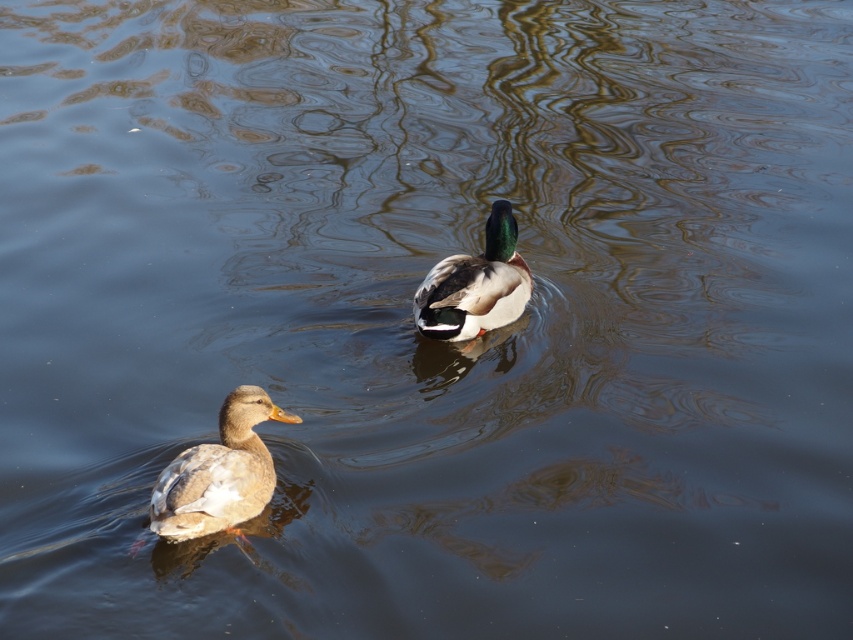
Is brown feathered duck at lower left above green glossy duck at center?

No, brown feathered duck at lower left is not above green glossy duck at center.

The height and width of the screenshot is (640, 853). Describe the element at coordinates (219, 472) in the screenshot. I see `brown feathered duck at lower left` at that location.

Where is `brown feathered duck at lower left`? brown feathered duck at lower left is located at coordinates (219, 472).